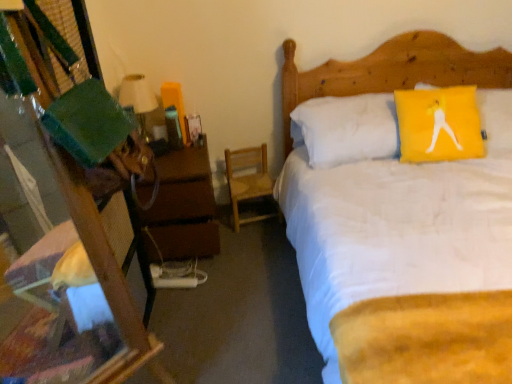
Question: Is wooden chair at center looking in the opposite direction of wooden desk at left?

Choices:
 (A) no
 (B) yes

Answer: (A)

Question: From a real-world perspective, is wooden chair at center beneath wooden desk at left?

Choices:
 (A) yes
 (B) no

Answer: (A)

Question: From a real-world perspective, does wooden chair at center stand above wooden desk at left?

Choices:
 (A) no
 (B) yes

Answer: (A)

Question: Considering the relative sizes of wooden chair at center and wooden desk at left in the image provided, is wooden chair at center thinner than wooden desk at left?

Choices:
 (A) yes
 (B) no

Answer: (A)

Question: Considering the relative sizes of wooden chair at center and wooden desk at left in the image provided, is wooden chair at center bigger than wooden desk at left?

Choices:
 (A) yes
 (B) no

Answer: (B)

Question: Can you confirm if wooden chair at center is smaller than wooden desk at left?

Choices:
 (A) yes
 (B) no

Answer: (A)

Question: Is brown wooden nightstand at left to the left of white soft bed at upper right from the viewer's perspective?

Choices:
 (A) yes
 (B) no

Answer: (A)

Question: Is brown wooden nightstand at left turned away from white soft bed at upper right?

Choices:
 (A) yes
 (B) no

Answer: (B)

Question: From a real-world perspective, is brown wooden nightstand at left over white soft bed at upper right?

Choices:
 (A) yes
 (B) no

Answer: (B)

Question: Is brown wooden nightstand at left shorter than white soft bed at upper right?

Choices:
 (A) yes
 (B) no

Answer: (A)

Question: Does brown wooden nightstand at left have a greater width compared to white soft bed at upper right?

Choices:
 (A) no
 (B) yes

Answer: (A)

Question: Can you confirm if brown wooden nightstand at left is bigger than white soft bed at upper right?

Choices:
 (A) no
 (B) yes

Answer: (A)

Question: Does matte white lampshade at left have a larger size compared to wooden desk at left?

Choices:
 (A) no
 (B) yes

Answer: (A)